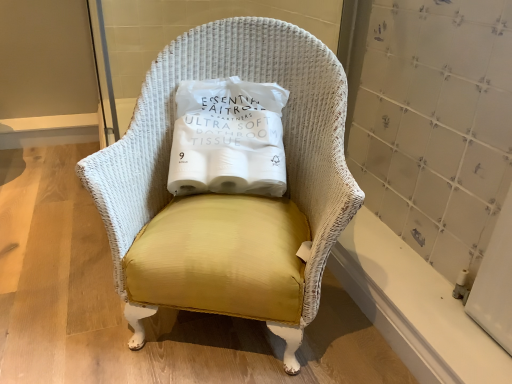
Question: Looking at the image, does white wicker chair at center seem bigger or smaller compared to yellow fabric pillow at center?

Choices:
 (A) small
 (B) big

Answer: (B)

Question: Is point (286, 41) positioned closer to the camera than point (197, 127)?

Choices:
 (A) farther
 (B) closer

Answer: (A)

Question: Is white wicker chair at center wider or thinner than yellow fabric pillow at center?

Choices:
 (A) wide
 (B) thin

Answer: (A)

Question: Choose the correct answer: Is yellow fabric pillow at center inside white wicker chair at center or outside it?

Choices:
 (A) inside
 (B) outside

Answer: (A)

Question: In terms of height, does yellow fabric pillow at center look taller or shorter compared to white wicker chair at center?

Choices:
 (A) tall
 (B) short

Answer: (B)

Question: Is yellow fabric pillow at center bigger or smaller than white wicker chair at center?

Choices:
 (A) big
 (B) small

Answer: (B)

Question: From the image's perspective, relative to white wicker chair at center, is yellow fabric pillow at center above or below?

Choices:
 (A) above
 (B) below

Answer: (A)